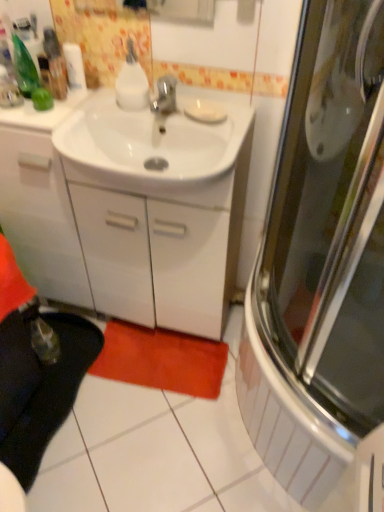
This screenshot has height=512, width=384. Identify the location of free point to the left of white glossy bottle at upper center, which ranks as the second bottle in left-to-right order. (92, 115).